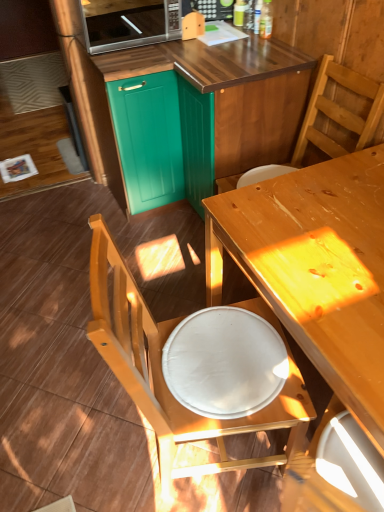
Where is `vacant point to the right of satin silver microwave at upper center`? vacant point to the right of satin silver microwave at upper center is located at coordinates (203, 42).